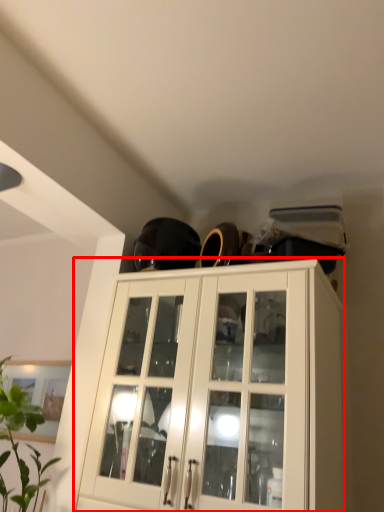
Question: From the image's perspective, considering the relative positions of cabinetry (annotated by the red box) and houseplant in the image provided, where is cabinetry (annotated by the red box) located with respect to the staircase?

Choices:
 (A) above
 (B) below

Answer: (B)